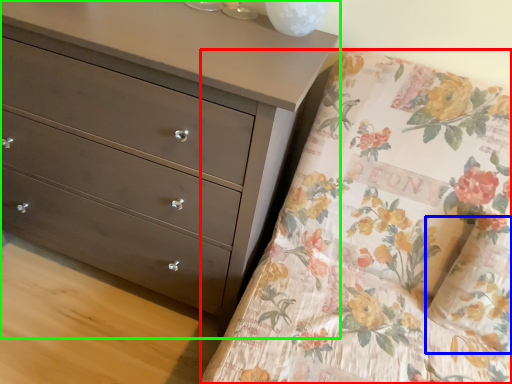
Question: Estimate the real-world distances between objects in this image. Which object is closer to mattress (highlighted by a red box), pillow (highlighted by a blue box) or chest of drawers (highlighted by a green box)?

Choices:
 (A) pillow
 (B) chest of drawers

Answer: (A)